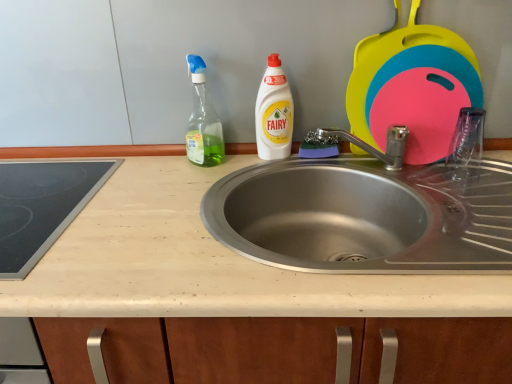
Identify the location of spots to the right of white plastic bottle at center, placed as the second cleaning product when sorted from left to right. Image resolution: width=512 pixels, height=384 pixels. (334, 162).